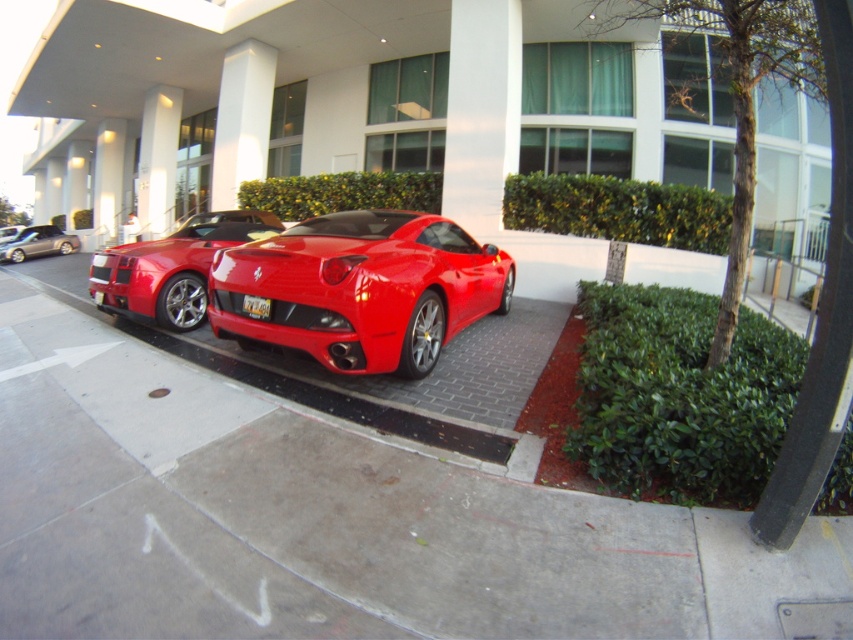
Can you confirm if glossy concrete curb at lower center is wider than silver metallic sedan at left?

Correct, the width of glossy concrete curb at lower center exceeds that of silver metallic sedan at left.

Is glossy concrete curb at lower center to the left of silver metallic sedan at left from the viewer's perspective?

No, glossy concrete curb at lower center is not to the left of silver metallic sedan at left.

Is point (491, 458) closer to viewer compared to point (70, 252)?

Yes, point (491, 458) is in front of point (70, 252).

Where is `glossy concrete curb at lower center`? The height and width of the screenshot is (640, 853). glossy concrete curb at lower center is located at coordinates (329, 396).

Is glossy concrete curb at lower center shorter than shiny red sports car at center?

Yes, glossy concrete curb at lower center is shorter than shiny red sports car at center.

Is glossy concrete curb at lower center smaller than shiny red sports car at center?

No, glossy concrete curb at lower center is not smaller than shiny red sports car at center.

Between point (474, 422) and point (120, 292), which one is positioned in front?

Positioned in front is point (474, 422).

Image resolution: width=853 pixels, height=640 pixels. I want to click on glossy concrete curb at lower center, so click(329, 396).

Is glossy red sports car at center thinner than glossy concrete curb at lower center?

Indeed, glossy red sports car at center has a lesser width compared to glossy concrete curb at lower center.

Is glossy red sports car at center wider than glossy concrete curb at lower center?

No, glossy red sports car at center is not wider than glossy concrete curb at lower center.

Does point (251, 273) lie behind point (398, 436)?

Yes, point (251, 273) is behind point (398, 436).

Where is `glossy red sports car at center`? glossy red sports car at center is located at coordinates (358, 289).